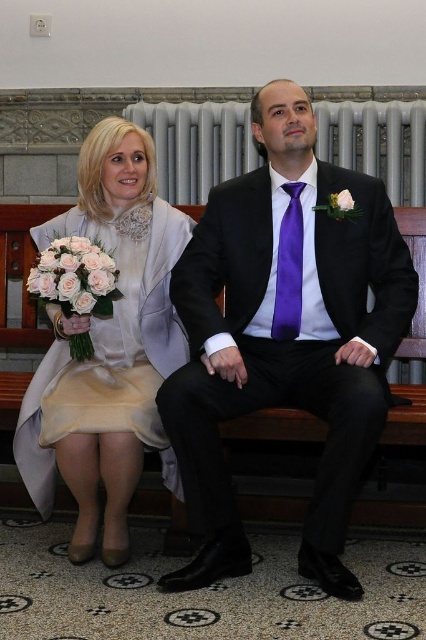
You are a photographer at a wedding reception. You need to position a camera stand to capture both the matte black suit at center and the pale pink silk bouquet at left in the same frame. Based on their positions, which object is closer to the left side of the frame?

The pale pink silk bouquet at left is closer to the left side of the frame because the matte black suit at center is to the right of it.

You are a photographer taking a portrait of the two people sitting on the bench. You want to ensure that both the pale pink silk bouquet at left and the white silk flower at center are clearly visible in the photo. Based on their positions, is there a risk that one might block the view of the other?

The pale pink silk bouquet at left is positioned under the white silk flower at center, so the white silk flower at center may block the view of the pale pink silk bouquet at left depending on the camera angle.

You are a photographer positioned behind the two people on the bench. You want to capture a closeup of both the pale pink silk bouquet at left and the white silk flower at center in the same frame. Which object should you focus on first to ensure both are in focus?

You should focus on the pale pink silk bouquet at left first because it is closer to the viewer than the white silk flower at center, so adjusting focus from near to far will help both be in focus.